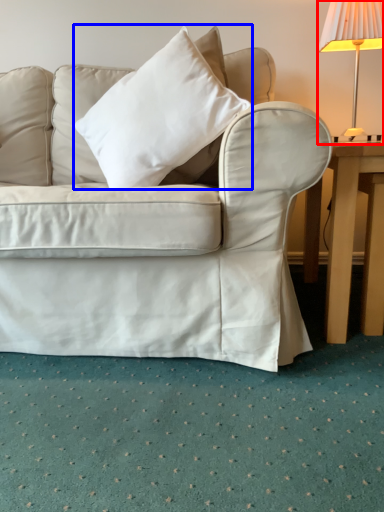
Question: Among these objects, which one is farthest to the camera, lamp (highlighted by a red box) or pillow (highlighted by a blue box)?

Choices:
 (A) lamp
 (B) pillow

Answer: (A)